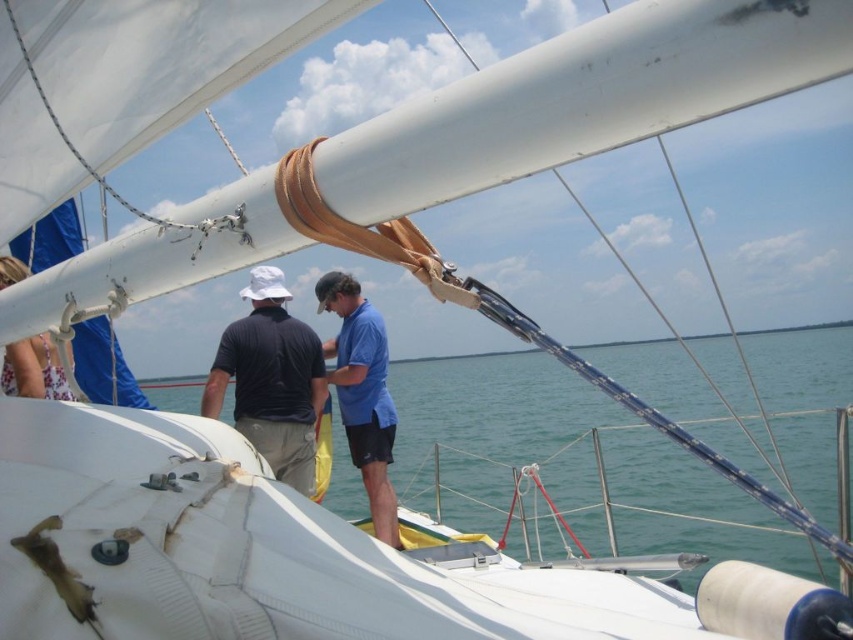
What do you see at coordinates (572, 464) in the screenshot?
I see `blue water at center` at bounding box center [572, 464].

Can you confirm if blue water at center is bigger than matte black shirt at center?

Yes, blue water at center is bigger than matte black shirt at center.

The image size is (853, 640). I want to click on blue water at center, so click(x=572, y=464).

Is blue water at center to the right of blue matte shirt at center from the viewer's perspective?

Correct, you'll find blue water at center to the right of blue matte shirt at center.

The image size is (853, 640). What do you see at coordinates (572, 464) in the screenshot? I see `blue water at center` at bounding box center [572, 464].

What are the coordinates of `blue water at center` in the screenshot? It's located at (572, 464).

Between matte black shirt at center and blue matte shirt at center, which one appears on the right side from the viewer's perspective?

From the viewer's perspective, blue matte shirt at center appears more on the right side.

Is point (303, 388) behind point (341, 276)?

No, (303, 388) is closer to viewer.

You are a GUI agent. You are given a task and a screenshot of the screen. Output one action in this format:
    pyautogui.click(x=<x>, y=<y>)
    Task: Click on the matte black shirt at center
    Image resolution: width=853 pixels, height=640 pixels.
    Given the screenshot: What is the action you would take?
    pyautogui.click(x=271, y=380)